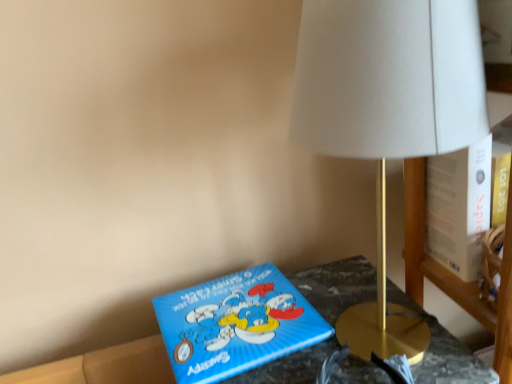
Question: Is blue cardboard box at lower left at the left side of blue matte puzzle box at lower center?

Choices:
 (A) yes
 (B) no

Answer: (B)

Question: Is blue cardboard box at lower left shorter than blue matte puzzle box at lower center?

Choices:
 (A) no
 (B) yes

Answer: (A)

Question: Could you tell me if blue cardboard box at lower left is facing blue matte puzzle box at lower center?

Choices:
 (A) yes
 (B) no

Answer: (B)

Question: Could blue matte puzzle box at lower center be considered to be inside blue cardboard box at lower left?

Choices:
 (A) no
 (B) yes

Answer: (B)

Question: Is blue cardboard box at lower left thinner than blue matte puzzle box at lower center?

Choices:
 (A) yes
 (B) no

Answer: (B)

Question: Is blue cardboard box at lower left in contact with blue matte puzzle box at lower center?

Choices:
 (A) yes
 (B) no

Answer: (A)

Question: Is gold metallic lamp at upper right completely or partially inside blue cardboard box at lower left?

Choices:
 (A) yes
 (B) no

Answer: (B)

Question: From the image's perspective, is blue cardboard box at lower left below gold metallic lamp at upper right?

Choices:
 (A) no
 (B) yes

Answer: (B)

Question: Is blue cardboard box at lower left oriented towards gold metallic lamp at upper right?

Choices:
 (A) yes
 (B) no

Answer: (B)

Question: From a real-world perspective, is blue cardboard box at lower left under gold metallic lamp at upper right?

Choices:
 (A) yes
 (B) no

Answer: (A)

Question: Is the surface of blue cardboard box at lower left in direct contact with gold metallic lamp at upper right?

Choices:
 (A) yes
 (B) no

Answer: (B)

Question: Is the depth of blue cardboard box at lower left less than that of gold metallic lamp at upper right?

Choices:
 (A) yes
 (B) no

Answer: (B)

Question: Does gold metallic lamp at upper right have a smaller size compared to blue cardboard box at lower left?

Choices:
 (A) no
 (B) yes

Answer: (B)